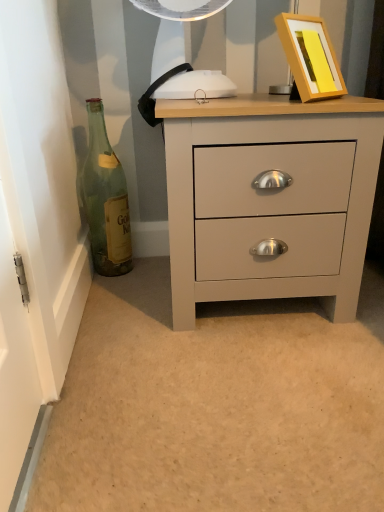
Question: Is green glass bottle at left wider than matte gray chest of drawers at center?

Choices:
 (A) yes
 (B) no

Answer: (B)

Question: Is green glass bottle at left positioned behind matte gray chest of drawers at center?

Choices:
 (A) yes
 (B) no

Answer: (A)

Question: From a real-world perspective, is green glass bottle at left over matte gray chest of drawers at center?

Choices:
 (A) no
 (B) yes

Answer: (B)

Question: Is green glass bottle at left facing away from matte gray chest of drawers at center?

Choices:
 (A) no
 (B) yes

Answer: (A)

Question: From the image's perspective, is green glass bottle at left above matte gray chest of drawers at center?

Choices:
 (A) yes
 (B) no

Answer: (A)

Question: Is point pyautogui.click(x=99, y=260) positioned closer to the camera than point pyautogui.click(x=292, y=286)?

Choices:
 (A) farther
 (B) closer

Answer: (A)

Question: In terms of size, does green glass bottle at left appear bigger or smaller than matte gray chest of drawers at center?

Choices:
 (A) big
 (B) small

Answer: (B)

Question: Considering their positions, is green glass bottle at left located in front of or behind matte gray chest of drawers at center?

Choices:
 (A) front
 (B) behind

Answer: (B)

Question: From a real-world perspective, is green glass bottle at left above or below matte gray chest of drawers at center?

Choices:
 (A) above
 (B) below

Answer: (A)

Question: From a real-world perspective, is yellow matte picture frame at upper right above or below green glass bottle at left?

Choices:
 (A) above
 (B) below

Answer: (A)

Question: From the image's perspective, is yellow matte picture frame at upper right above or below green glass bottle at left?

Choices:
 (A) above
 (B) below

Answer: (A)

Question: In the image, is yellow matte picture frame at upper right on the left side or the right side of green glass bottle at left?

Choices:
 (A) left
 (B) right

Answer: (B)

Question: Looking at the image, does yellow matte picture frame at upper right seem bigger or smaller compared to green glass bottle at left?

Choices:
 (A) small
 (B) big

Answer: (B)

Question: In the image, is yellow matte picture frame at upper right positioned in front of or behind matte gray chest of drawers at center?

Choices:
 (A) behind
 (B) front

Answer: (A)

Question: In terms of width, does yellow matte picture frame at upper right look wider or thinner when compared to matte gray chest of drawers at center?

Choices:
 (A) thin
 (B) wide

Answer: (A)